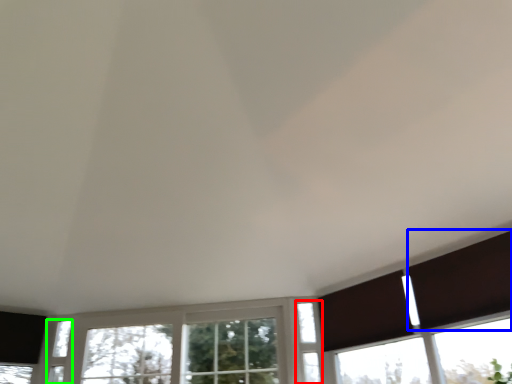
Question: Based on their relative distances, which object is nearer to window (highlighted by a red box)? Choose from shutter (highlighted by a blue box) and window (highlighted by a green box).

Choices:
 (A) shutter
 (B) window

Answer: (A)